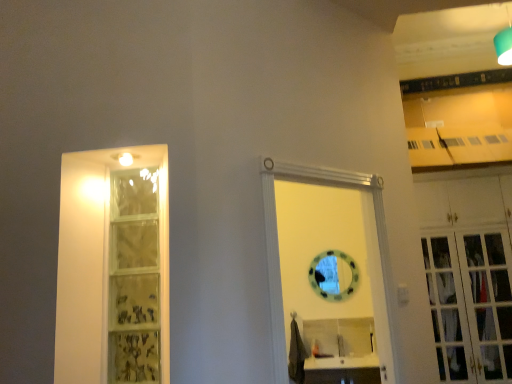
Question: Is white wooden door at center aimed at white wood cabinet at right?

Choices:
 (A) no
 (B) yes

Answer: (A)

Question: Can you confirm if white wooden door at center is taller than white wood cabinet at right?

Choices:
 (A) no
 (B) yes

Answer: (A)

Question: Is white wooden door at center surrounding white wood cabinet at right?

Choices:
 (A) yes
 (B) no

Answer: (B)

Question: Does white wooden door at center appear on the right side of white wood cabinet at right?

Choices:
 (A) no
 (B) yes

Answer: (A)

Question: Can you confirm if white wooden door at center is shorter than white wood cabinet at right?

Choices:
 (A) no
 (B) yes

Answer: (B)

Question: Can you confirm if white wooden door at center is wider than white wood cabinet at right?

Choices:
 (A) yes
 (B) no

Answer: (B)

Question: Is white wood cabinet at right oriented away from matte glass shelf at left?

Choices:
 (A) no
 (B) yes

Answer: (A)

Question: Considering the relative sizes of white wood cabinet at right and matte glass shelf at left in the image provided, is white wood cabinet at right smaller than matte glass shelf at left?

Choices:
 (A) yes
 (B) no

Answer: (B)

Question: Considering the relative sizes of white wood cabinet at right and matte glass shelf at left in the image provided, is white wood cabinet at right wider than matte glass shelf at left?

Choices:
 (A) no
 (B) yes

Answer: (B)

Question: Would you say white wood cabinet at right is outside matte glass shelf at left?

Choices:
 (A) no
 (B) yes

Answer: (B)

Question: Is white wood cabinet at right to the left of matte glass shelf at left from the viewer's perspective?

Choices:
 (A) no
 (B) yes

Answer: (A)

Question: Considering the relative sizes of white wood cabinet at right and matte glass shelf at left in the image provided, is white wood cabinet at right bigger than matte glass shelf at left?

Choices:
 (A) yes
 (B) no

Answer: (A)

Question: From the image's perspective, does white wooden door at center appear lower than matte glass shelf at left?

Choices:
 (A) yes
 (B) no

Answer: (A)